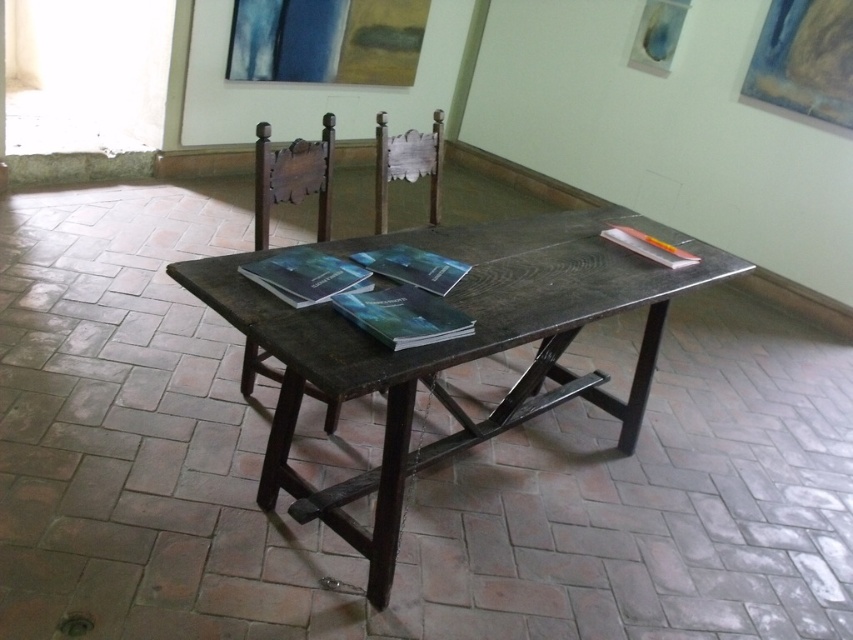
You are sitting in the wooden chair at center and want to reach the dark wood table at center. In which direction should you move to get to the table?

You should move to your left to reach the dark wood table at center because the dark wood table at center is to the right of the wooden chair at center, so moving left from the chair would align you towards the table.

You are sitting at the table and want to move to the chair that is on the right side. Which chair should you choose between the dark wood chair at center and the wooden chair at center?

The wooden chair at center is on the right side, so you should choose the wooden chair at center.

You are a person who is 6 feet tall and standing in the room. You want to sit down at the dark wood table at center. Is the dark wood chair at center close enough for you to comfortably reach the table?

The dark wood table at center is 31.76 inches away from the dark wood chair at center. The average comfortable distance between a chair and a table for someone 6 feet tall is typically around 24 to 30 inches. Since 31.76 inches is slightly beyond this range, the chair might be a bit too far for comfortable reach.